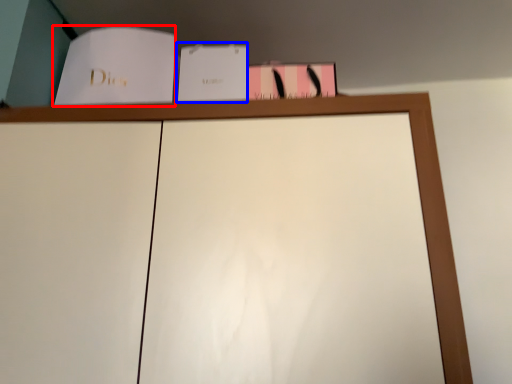
Question: Which object appears farthest to the camera in this image, paperback book (highlighted by a red box) or paperback book (highlighted by a blue box)?

Choices:
 (A) paperback book
 (B) paperback book

Answer: (B)